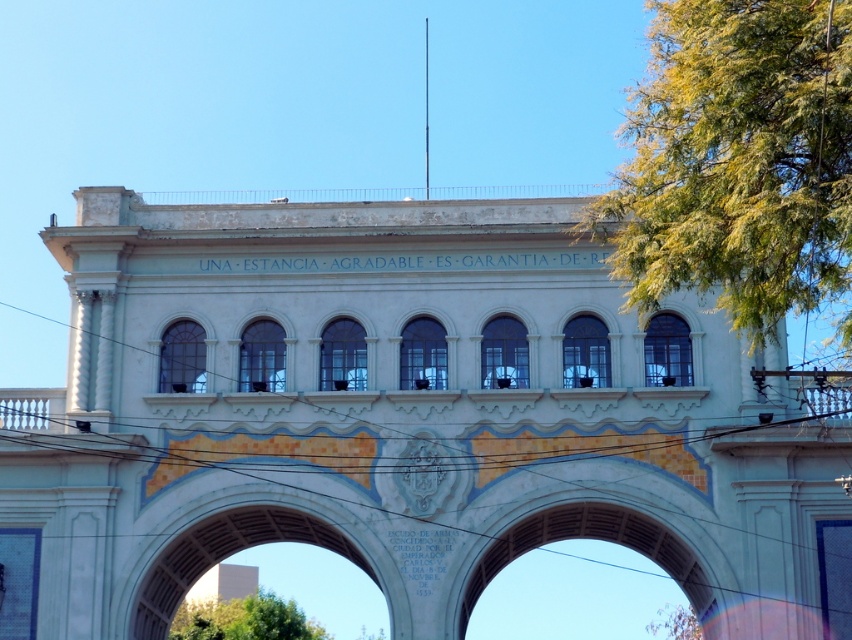
Question: Does green leafy tree at lower center have a larger size compared to green leafy tree at lower right?

Choices:
 (A) no
 (B) yes

Answer: (B)

Question: Among these objects, which one is nearest to the camera?

Choices:
 (A) green leafy tree at lower center
 (B) green leafy tree at upper right
 (C) white stone archway at center

Answer: (B)

Question: Which of the following is the farthest from the observer?

Choices:
 (A) (242, 516)
 (B) (652, 632)

Answer: (B)

Question: Which object is the farthest from the white stone archway at center?

Choices:
 (A) green leafy tree at upper right
 (B) green leafy tree at lower right
 (C) green leafy tree at lower center

Answer: (B)

Question: Does white stone archway at center have a smaller size compared to green leafy tree at lower right?

Choices:
 (A) yes
 (B) no

Answer: (B)

Question: From the image, what is the correct spatial relationship of green leafy tree at upper right in relation to green leafy tree at lower center?

Choices:
 (A) right
 (B) left

Answer: (A)